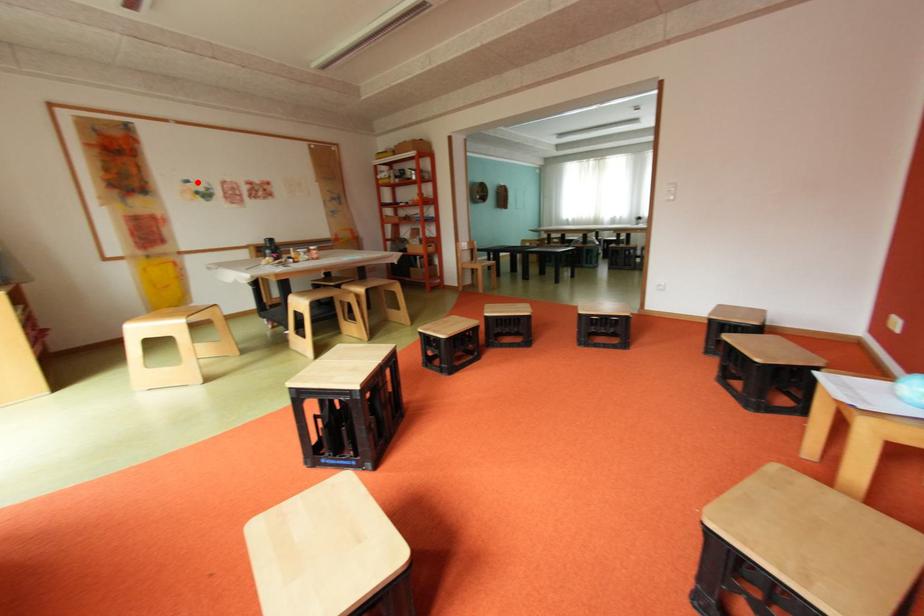
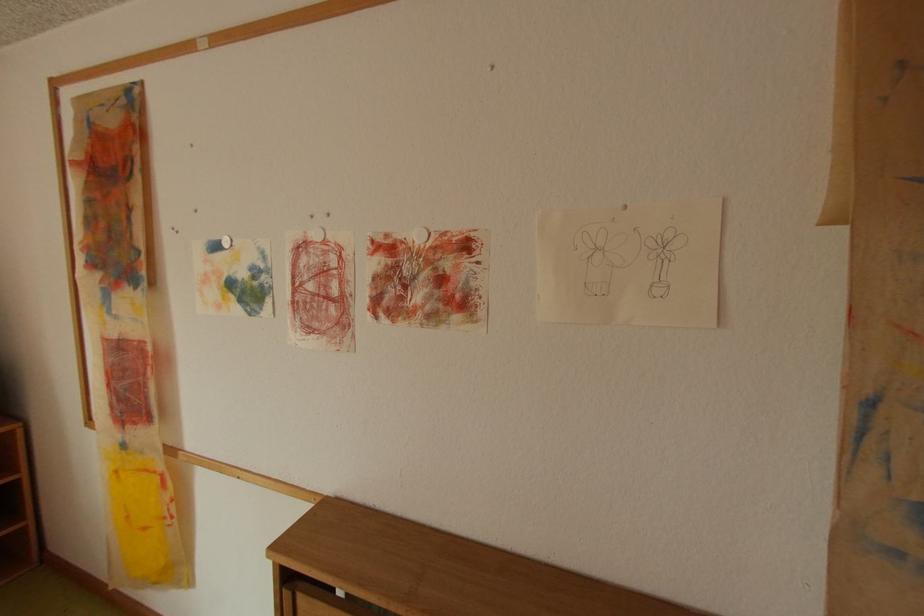
In the second image, find the point that corresponds to the highlighted location in the first image.

(225, 246)